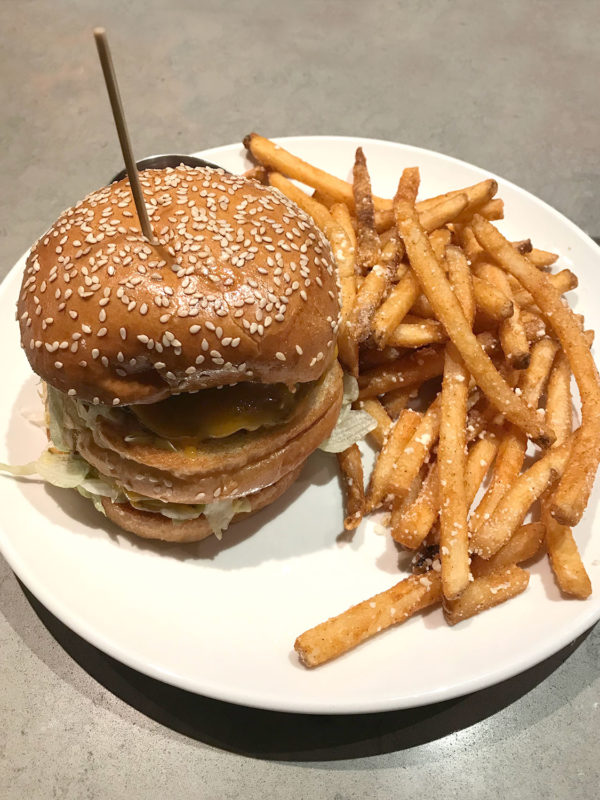
In order to click on shadows cast by plate in this screenshot , I will do `click(191, 708)`, `click(146, 702)`, `click(99, 692)`, `click(377, 745)`, `click(548, 698)`.